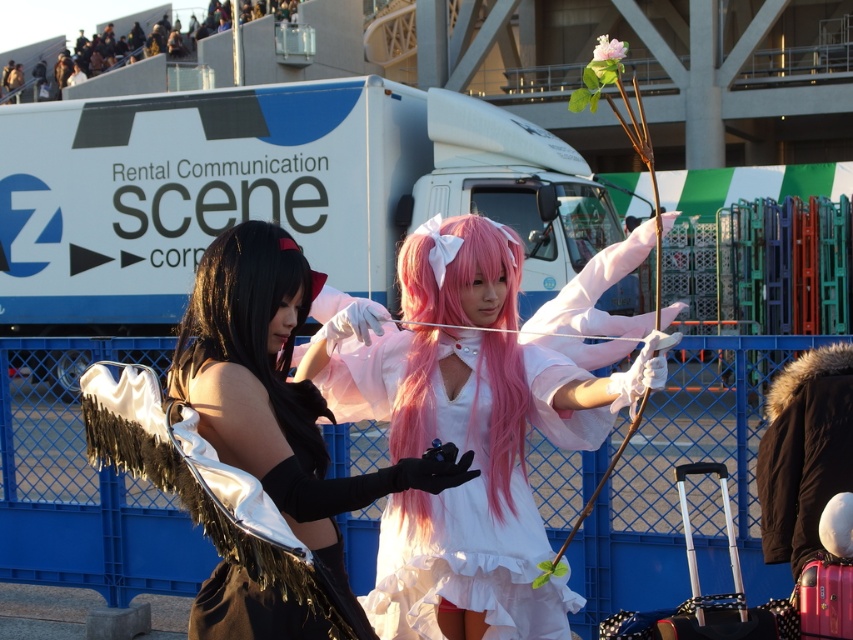
Image resolution: width=853 pixels, height=640 pixels. Identify the location of white satin dress at center. [x=463, y=435].

Does white satin dress at center have a lesser width compared to satin-like white wings at center?

In fact, white satin dress at center might be wider than satin-like white wings at center.

At what (x,y) coordinates should I click in order to perform the action: click on white satin dress at center. Please return your answer as a coordinate pair (x, y). Image resolution: width=853 pixels, height=640 pixels. Looking at the image, I should click on (463, 435).

Does white satin dress at center have a larger size compared to black fur coat at right?

Yes.

Does white satin dress at center appear on the left side of black fur coat at right?

Correct, you'll find white satin dress at center to the left of black fur coat at right.

Which is in front, point (351, 390) or point (819, 484)?

Positioned in front is point (351, 390).

Find the location of `white satin dress at center`. white satin dress at center is located at coordinates (463, 435).

Consider the image. Can you confirm if white satin dress at center is wider than black silky hair at left?

Yes, white satin dress at center is wider than black silky hair at left.

This screenshot has height=640, width=853. In order to click on white satin dress at center in this screenshot , I will do `click(463, 435)`.

Who is more forward, (451, 582) or (318, 438)?

Point (318, 438) is in front.

Image resolution: width=853 pixels, height=640 pixels. Identify the location of white satin dress at center. (463, 435).